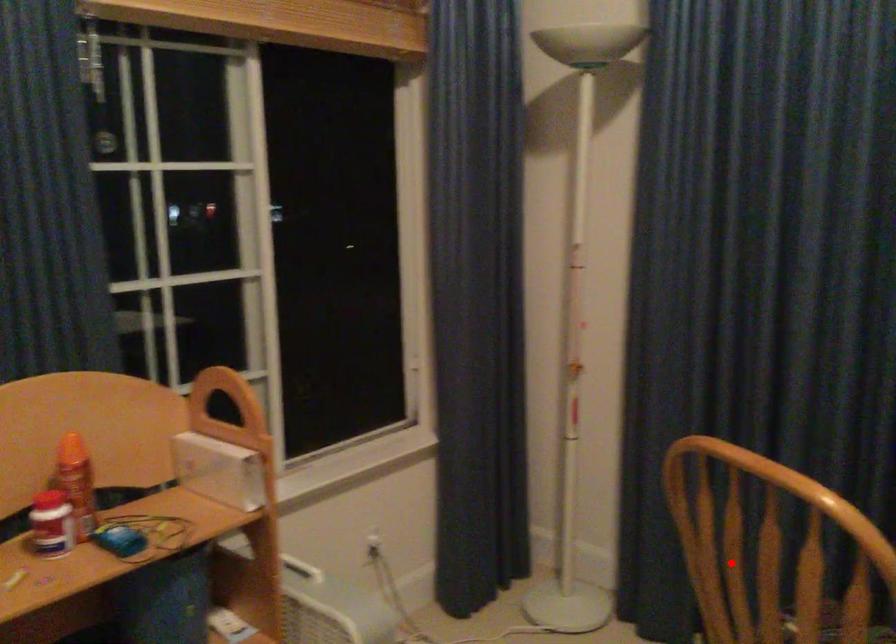
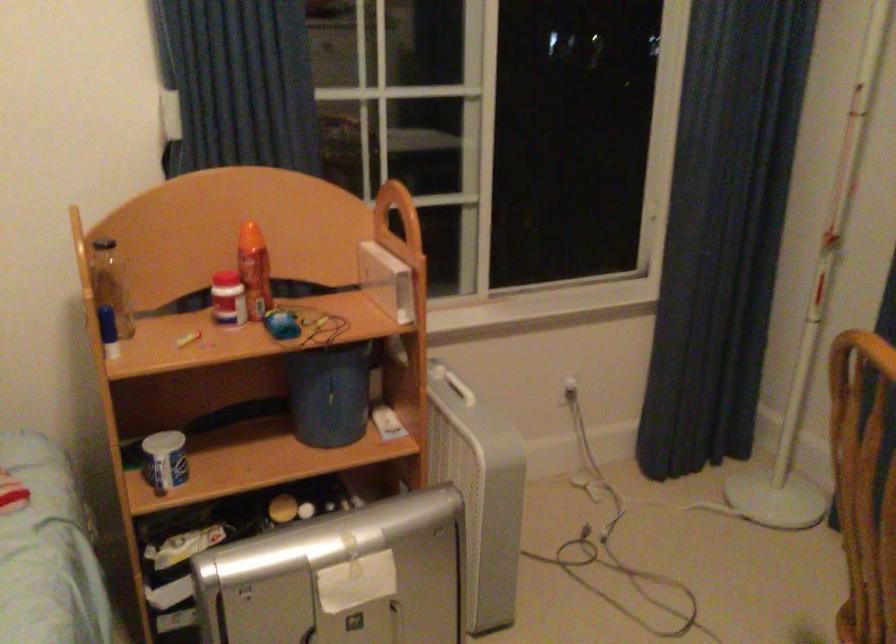
In the second image, find the point that corresponds to the highlighted location in the first image.

(864, 484)